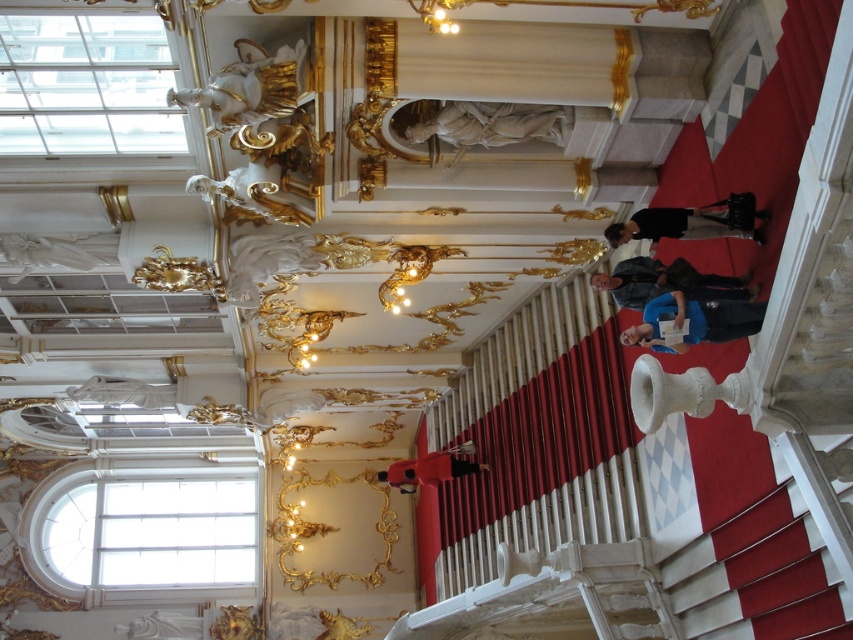
Question: Can you confirm if white marble statue at upper center is positioned below dark gray fabric jacket at center?

Choices:
 (A) no
 (B) yes

Answer: (A)

Question: Which of the following is the farthest from the observer?

Choices:
 (A) black leather bag at center
 (B) dark gray fabric jacket at center
 (C) blue fabric at center
 (D) white marble statue at upper center

Answer: (D)

Question: Which point is closer to the camera taking this photo?

Choices:
 (A) (749, 330)
 (B) (405, 132)
 (C) (737, 218)

Answer: (A)

Question: Can you confirm if blue fabric at center is positioned to the right of dark gray fabric jacket at center?

Choices:
 (A) yes
 (B) no

Answer: (A)

Question: Which of the following is the farthest from the observer?

Choices:
 (A) blue fabric at center
 (B) dark gray fabric jacket at center
 (C) black leather bag at center
 (D) white marble statue at upper center

Answer: (D)

Question: Where is blue fabric at center located in relation to black leather bag at center in the image?

Choices:
 (A) above
 (B) below

Answer: (B)